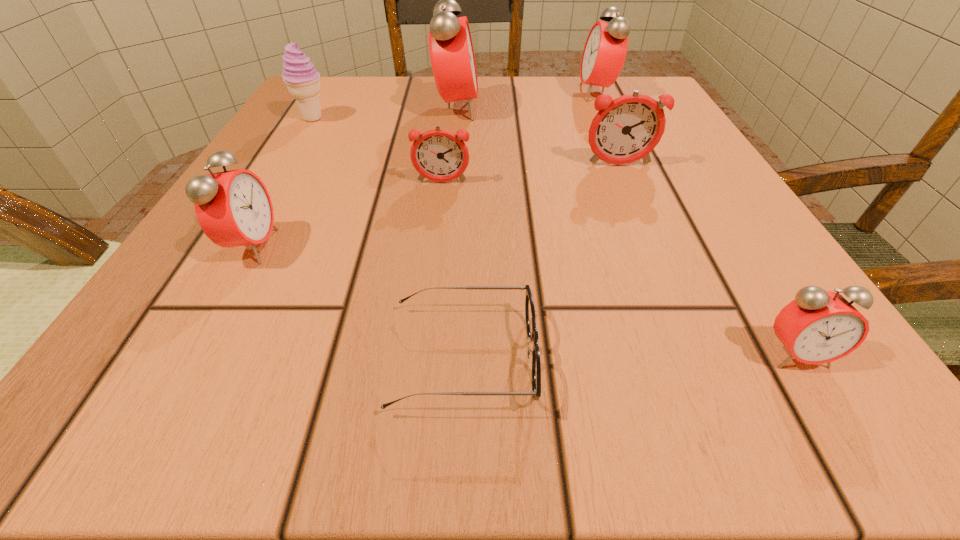
Where is `vacant region between the fifth farthest alarm clock and the right reddish-pink alarm clock`? This screenshot has height=540, width=960. vacant region between the fifth farthest alarm clock and the right reddish-pink alarm clock is located at coordinates (436, 206).

Locate an element on the screen. vacant area that lies between the purple icecream and the leftmost alarm clock is located at coordinates (282, 183).

Where is `free area in between the shortest object and the nearest red alarm clock`? Image resolution: width=960 pixels, height=540 pixels. free area in between the shortest object and the nearest red alarm clock is located at coordinates (630, 356).

Point out which object is positioned as the sixth nearest to the leftmost alarm clock. Please provide its 2D coordinates. Your answer should be formatted as a tuple, i.e. [(x, y)], where the tuple contains the x and y coordinates of a point satisfying the conditions above.

[(819, 326)]

You are a GUI agent. You are given a task and a screenshot of the screen. Output one action in this format:
    pyautogui.click(x=<x>, y=<y>)
    Task: Click on the object that stands as the sixth closest to the biggest red alarm clock
    
    Given the screenshot: What is the action you would take?
    (532, 332)

Select which alarm clock appears as the second closest to the tallest alarm clock. Please provide its 2D coordinates. Your answer should be formatted as a tuple, i.e. [(x, y)], where the tuple contains the x and y coordinates of a point satisfying the conditions above.

[(604, 54)]

Select which alarm clock appears as the fourth closest to the second nearest alarm clock. Please provide its 2D coordinates. Your answer should be formatted as a tuple, i.e. [(x, y)], where the tuple contains the x and y coordinates of a point satisfying the conditions above.

[(819, 326)]

Choose which red alarm clock is the second nearest neighbor to the nearer reddish-pink alarm clock. Please provide its 2D coordinates. Your answer should be formatted as a tuple, i.e. [(x, y)], where the tuple contains the x and y coordinates of a point satisfying the conditions above.

[(233, 208)]

Point out which red alarm clock is positioned as the nearest to the second tallest alarm clock. Please provide its 2D coordinates. Your answer should be formatted as a tuple, i.e. [(x, y)], where the tuple contains the x and y coordinates of a point satisfying the conditions above.

[(452, 57)]

I want to click on free location that satisfies the following two spatial constraints: 1. on the front-facing side of the second red alarm clock from right to left; 2. on the front-facing side of the farther reddish-pink alarm clock, so click(629, 165).